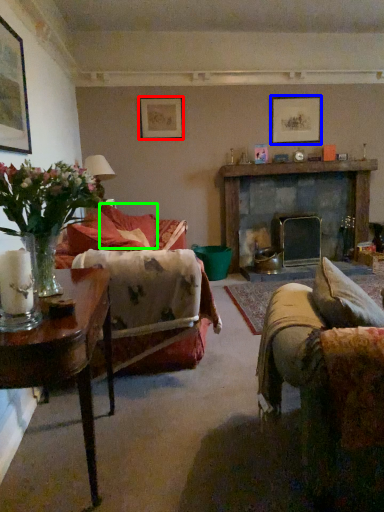
Question: Which is nearer to the picture frame (highlighted by a red box)? picture frame (highlighted by a blue box) or pillow (highlighted by a green box).

Choices:
 (A) picture frame
 (B) pillow

Answer: (B)